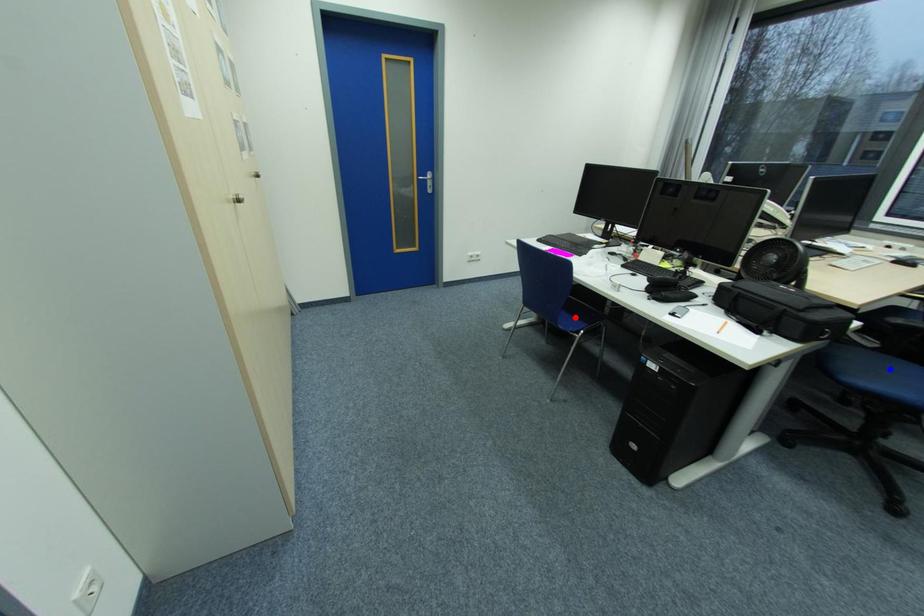
Question: Two points are marked on the image. Which point is closer to the camera?

Choices:
 (A) Blue point is closer.
 (B) Red point is closer.

Answer: (A)